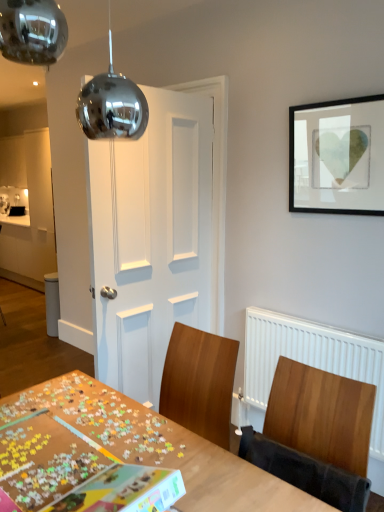
Question: Is wooden puzzle board at center placed right next to wooden chair at right?

Choices:
 (A) no
 (B) yes

Answer: (A)

Question: From a real-world perspective, is wooden puzzle board at center on top of wooden chair at right?

Choices:
 (A) yes
 (B) no

Answer: (B)

Question: Does wooden puzzle board at center have a lesser height compared to wooden chair at right?

Choices:
 (A) yes
 (B) no

Answer: (B)

Question: Does wooden puzzle board at center have a lesser width compared to wooden chair at right?

Choices:
 (A) yes
 (B) no

Answer: (B)

Question: Does wooden puzzle board at center have a smaller size compared to wooden chair at right?

Choices:
 (A) no
 (B) yes

Answer: (A)

Question: From the image's perspective, is white matte door at center located above or below wooden chair at right?

Choices:
 (A) above
 (B) below

Answer: (A)

Question: Choose the correct answer: Is white matte door at center inside wooden chair at right or outside it?

Choices:
 (A) outside
 (B) inside

Answer: (A)

Question: Looking at their shapes, would you say white matte door at center is wider or thinner than wooden chair at right?

Choices:
 (A) wide
 (B) thin

Answer: (A)

Question: Would you say white matte door at center is to the left or to the right of wooden chair at right in the picture?

Choices:
 (A) right
 (B) left

Answer: (B)

Question: Would you say wooden puzzle board at center is to the left or to the right of white matte door at center in the picture?

Choices:
 (A) left
 (B) right

Answer: (A)

Question: In the image, is wooden puzzle board at center positioned in front of or behind white matte door at center?

Choices:
 (A) front
 (B) behind

Answer: (A)

Question: From the image's perspective, is wooden puzzle board at center positioned above or below white matte door at center?

Choices:
 (A) below
 (B) above

Answer: (A)

Question: Looking at their shapes, would you say wooden puzzle board at center is wider or thinner than white matte door at center?

Choices:
 (A) wide
 (B) thin

Answer: (A)

Question: Is point (261, 458) closer or farther from the camera than point (190, 168)?

Choices:
 (A) farther
 (B) closer

Answer: (B)

Question: Looking at the image, does wooden chair at right seem bigger or smaller compared to white matte door at center?

Choices:
 (A) small
 (B) big

Answer: (A)